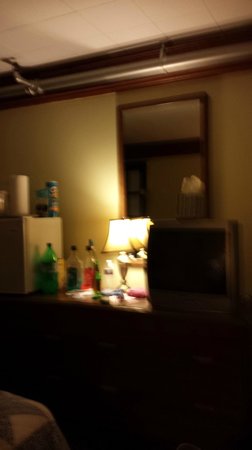
The image size is (252, 450). What are the coordinates of `mirror` in the screenshot? It's located at (164, 139).